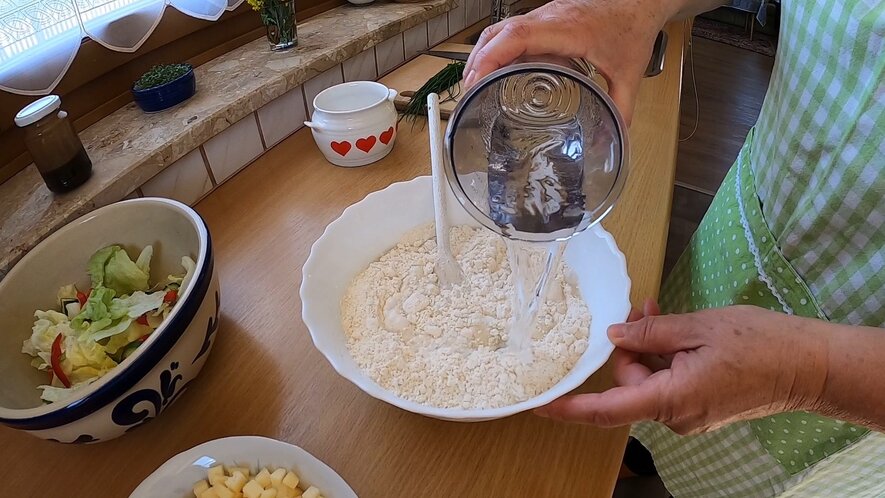
This screenshot has width=885, height=498. In order to click on bowl in this screenshot , I will do `click(135, 387)`, `click(334, 342)`, `click(270, 448)`, `click(331, 118)`.